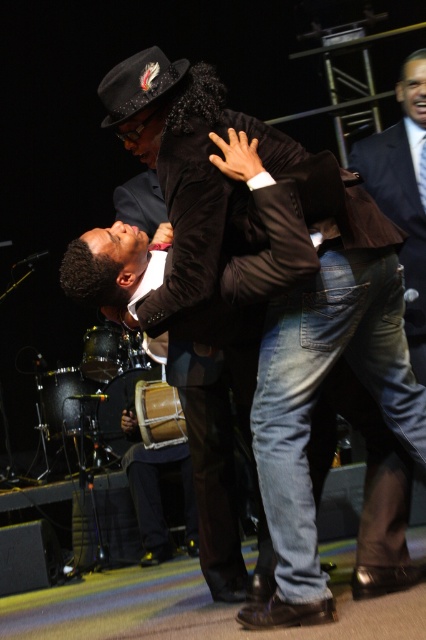
The height and width of the screenshot is (640, 426). What do you see at coordinates (403, 192) in the screenshot? I see `dark brown suit at upper right` at bounding box center [403, 192].

Who is lower down, dark brown suit at upper right or wooden drum at center?

wooden drum at center

Is point (412, 269) farther from viewer compared to point (181, 426)?

That is False.

Where is `dark brown suit at upper right`? Image resolution: width=426 pixels, height=640 pixels. dark brown suit at upper right is located at coordinates (403, 192).

Can you confirm if black leather jacket at center is positioned to the left of dark brown suit at upper right?

Correct, you'll find black leather jacket at center to the left of dark brown suit at upper right.

Does black leather jacket at center have a lesser width compared to dark brown suit at upper right?

No.

What are the coordinates of `black leather jacket at center` in the screenshot? It's located at (317, 388).

This screenshot has height=640, width=426. I want to click on black leather jacket at center, so click(317, 388).

Is black leather jacket at center to the left of wooden drum at center from the viewer's perspective?

Incorrect, black leather jacket at center is not on the left side of wooden drum at center.

Which is behind, point (379, 483) or point (167, 442)?

Positioned behind is point (167, 442).

Where is `black leather jacket at center`? black leather jacket at center is located at coordinates (317, 388).